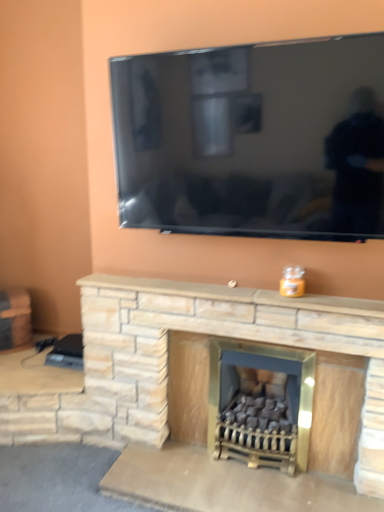
The width and height of the screenshot is (384, 512). I want to click on matte stone fireplace at center, acting as the second fireplace starting from the left, so click(x=260, y=405).

Image resolution: width=384 pixels, height=512 pixels. Describe the element at coordinates (15, 319) in the screenshot. I see `brushed metal side table at left` at that location.

Image resolution: width=384 pixels, height=512 pixels. Identify the location of natural stone fireplace at center. (239, 313).

How much space does natural stone fireplace at center, which ranks as the 1th fireplace in left-to-right order, occupy vertically?

It is 33.46 inches.

You are a GUI agent. You are given a task and a screenshot of the screen. Output one action in this format:
    pyautogui.click(x=<x>, y=<y>)
    Task: Click on the matte stone fireplace at center, acting as the second fireplace starting from the left
    The image size is (384, 512).
    Given the screenshot: What is the action you would take?
    pyautogui.click(x=260, y=405)

Based on the photo, can you tell me how much matte stone fireplace at center, acting as the first fireplace starting from the right, and natural stone fireplace at center, which ranks as the 1th fireplace in left-to-right order, differ in facing direction?

They differ by 0.00527 degrees in their facing directions.

Consider the image. Is matte stone fireplace at center, acting as the second fireplace starting from the left, positioned with its back to natural stone fireplace at center, which ranks as the 1th fireplace in left-to-right order?

Yes, matte stone fireplace at center, acting as the second fireplace starting from the left, is positioned with its back facing natural stone fireplace at center, which ranks as the 1th fireplace in left-to-right order.

Are matte stone fireplace at center, acting as the second fireplace starting from the left, and natural stone fireplace at center, the 2th fireplace from the right, located far from each other?

No, there isn't a large distance between matte stone fireplace at center, acting as the second fireplace starting from the left, and natural stone fireplace at center, the 2th fireplace from the right.

Find the location of a particular element. Image resolution: width=384 pixels, height=512 pixels. fireplace located behind the natural stone fireplace at center, the 2th fireplace from the right is located at coordinates (260, 405).

Is natural stone fireplace at center shorter than brushed metal side table at left?

Yes, natural stone fireplace at center is shorter than brushed metal side table at left.

From the picture: Is natural stone fireplace at center not close to brushed metal side table at left?

natural stone fireplace at center is far away from brushed metal side table at left.

Considering the relative positions of natural stone fireplace at center and brushed metal side table at left in the image provided, is natural stone fireplace at center to the right of brushed metal side table at left from the viewer's perspective?

Yes.

Between natural stone fireplace at center, the 2th fireplace from the right, and natural stone fireplace at center, which one has larger size?

With larger size is natural stone fireplace at center, the 2th fireplace from the right.

Does natural stone fireplace at center, which ranks as the 1th fireplace in left-to-right order, touch natural stone fireplace at center?

Yes, natural stone fireplace at center, which ranks as the 1th fireplace in left-to-right order, is touching natural stone fireplace at center.

Based on the photo, can you confirm if natural stone fireplace at center, which ranks as the 1th fireplace in left-to-right order, is shorter than natural stone fireplace at center?

Incorrect, the height of natural stone fireplace at center, which ranks as the 1th fireplace in left-to-right order, does not fall short of that of natural stone fireplace at center.

The height and width of the screenshot is (512, 384). I want to click on furniture below the natural stone fireplace at center (from a real-world perspective), so click(15, 319).

Does brushed metal side table at left turn towards natural stone fireplace at center?

No, brushed metal side table at left does not turn towards natural stone fireplace at center.

From a real-world perspective, between brushed metal side table at left and natural stone fireplace at center, who is vertically higher?

natural stone fireplace at center is physically above.

Considering the relative sizes of natural stone fireplace at center and natural stone fireplace at center, the 2th fireplace from the right, in the image provided, is natural stone fireplace at center smaller than natural stone fireplace at center, the 2th fireplace from the right,?

Indeed, natural stone fireplace at center has a smaller size compared to natural stone fireplace at center, the 2th fireplace from the right.

Considering the sizes of objects natural stone fireplace at center and natural stone fireplace at center, which ranks as the 1th fireplace in left-to-right order, in the image provided, who is thinner, natural stone fireplace at center or natural stone fireplace at center, which ranks as the 1th fireplace in left-to-right order,?

With smaller width is natural stone fireplace at center.

Where is `mantle above the natural stone fireplace at center, the 2th fireplace from the right (from a real-world perspective)`? Image resolution: width=384 pixels, height=512 pixels. mantle above the natural stone fireplace at center, the 2th fireplace from the right (from a real-world perspective) is located at coordinates (239, 313).

Where is `the 1st fireplace below the brushed metal side table at left (from the image's perspective)`? the 1st fireplace below the brushed metal side table at left (from the image's perspective) is located at coordinates [x=221, y=336].

Is natural stone fireplace at center, which ranks as the 1th fireplace in left-to-right order, not within brushed metal side table at left?

Yes, natural stone fireplace at center, which ranks as the 1th fireplace in left-to-right order, is outside of brushed metal side table at left.

Which is less distant, (302, 327) or (10, 302)?

Point (302, 327) is positioned closer to the camera compared to point (10, 302).

Consider the image. Does matte stone fireplace at center, acting as the first fireplace starting from the right, have a greater height compared to natural stone fireplace at center?

Yes, matte stone fireplace at center, acting as the first fireplace starting from the right, is taller than natural stone fireplace at center.

Does matte stone fireplace at center, acting as the second fireplace starting from the left, have a larger size compared to natural stone fireplace at center?

Correct, matte stone fireplace at center, acting as the second fireplace starting from the left, is larger in size than natural stone fireplace at center.

How many degrees apart are the facing directions of matte stone fireplace at center, acting as the second fireplace starting from the left, and natural stone fireplace at center?

The facing directions of matte stone fireplace at center, acting as the second fireplace starting from the left, and natural stone fireplace at center are 0.00652 degrees apart.

Which of these two, matte stone fireplace at center, acting as the first fireplace starting from the right, or natural stone fireplace at center, is thinner?

natural stone fireplace at center is thinner.

The height and width of the screenshot is (512, 384). What are the coordinates of `fireplace located in front of the matte stone fireplace at center, acting as the second fireplace starting from the left` in the screenshot? It's located at pyautogui.click(x=221, y=336).

The image size is (384, 512). There is a brushed metal side table at left. What are the coordinates of `mantle above it (from a real-world perspective)` in the screenshot? It's located at 239,313.

Estimate the real-world distances between objects in this image. Which object is further from natural stone fireplace at center, which ranks as the 1th fireplace in left-to-right order, natural stone fireplace at center or matte stone fireplace at center, acting as the first fireplace starting from the right?

matte stone fireplace at center, acting as the first fireplace starting from the right, is positioned further to the anchor natural stone fireplace at center, which ranks as the 1th fireplace in left-to-right order.

Estimate the real-world distances between objects in this image. Which object is further from matte stone fireplace at center, acting as the second fireplace starting from the left, natural stone fireplace at center or brushed metal side table at left?

The object further to matte stone fireplace at center, acting as the second fireplace starting from the left, is brushed metal side table at left.

Based on their spatial positions, is matte stone fireplace at center, acting as the first fireplace starting from the right, or natural stone fireplace at center closer to brushed metal side table at left?

natural stone fireplace at center.

Based on their spatial positions, is natural stone fireplace at center, which ranks as the 1th fireplace in left-to-right order, or brushed metal side table at left closer to natural stone fireplace at center?

Among the two, natural stone fireplace at center, which ranks as the 1th fireplace in left-to-right order, is located nearer to natural stone fireplace at center.

Estimate the real-world distances between objects in this image. Which object is further from matte stone fireplace at center, acting as the first fireplace starting from the right, natural stone fireplace at center or natural stone fireplace at center, the 2th fireplace from the right?

The object further to matte stone fireplace at center, acting as the first fireplace starting from the right, is natural stone fireplace at center.

Looking at the image, which one is located closer to natural stone fireplace at center, which ranks as the 1th fireplace in left-to-right order, brushed metal side table at left or matte stone fireplace at center, acting as the first fireplace starting from the right?

matte stone fireplace at center, acting as the first fireplace starting from the right, lies closer to natural stone fireplace at center, which ranks as the 1th fireplace in left-to-right order, than the other object.

From the image, which object appears to be nearer to brushed metal side table at left, matte stone fireplace at center, acting as the first fireplace starting from the right, or natural stone fireplace at center, the 2th fireplace from the right?

The object closer to brushed metal side table at left is natural stone fireplace at center, the 2th fireplace from the right.

From the image, which object appears to be farther from natural stone fireplace at center, the 2th fireplace from the right, matte stone fireplace at center, acting as the first fireplace starting from the right, or brushed metal side table at left?

Among the two, brushed metal side table at left is located further to natural stone fireplace at center, the 2th fireplace from the right.

The width and height of the screenshot is (384, 512). Find the location of `fireplace between natural stone fireplace at center and matte stone fireplace at center, acting as the second fireplace starting from the left, vertically`. fireplace between natural stone fireplace at center and matte stone fireplace at center, acting as the second fireplace starting from the left, vertically is located at coordinates (221, 336).

Where is `mantle located between brushed metal side table at left and natural stone fireplace at center, which ranks as the 1th fireplace in left-to-right order, in the left-right direction`? This screenshot has height=512, width=384. mantle located between brushed metal side table at left and natural stone fireplace at center, which ranks as the 1th fireplace in left-to-right order, in the left-right direction is located at coordinates (239, 313).

The width and height of the screenshot is (384, 512). Find the location of `mantle located between brushed metal side table at left and matte stone fireplace at center, acting as the first fireplace starting from the right, in the left-right direction`. mantle located between brushed metal side table at left and matte stone fireplace at center, acting as the first fireplace starting from the right, in the left-right direction is located at coordinates (239, 313).

Identify the location of fireplace located between brushed metal side table at left and matte stone fireplace at center, acting as the first fireplace starting from the right, in the left-right direction. (221, 336).